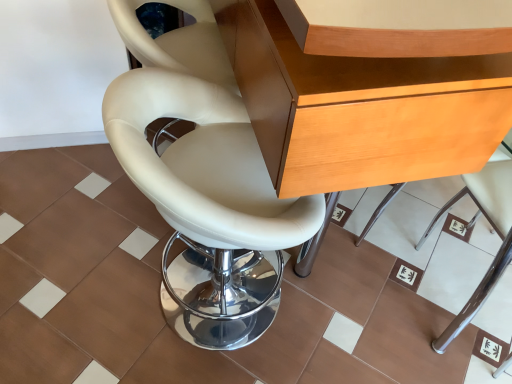
Identify the location of vacant space underneath white leather chair at center, which appears as the 2th chair when viewed from the right (from a real-world perspective). The height and width of the screenshot is (384, 512). (193, 311).